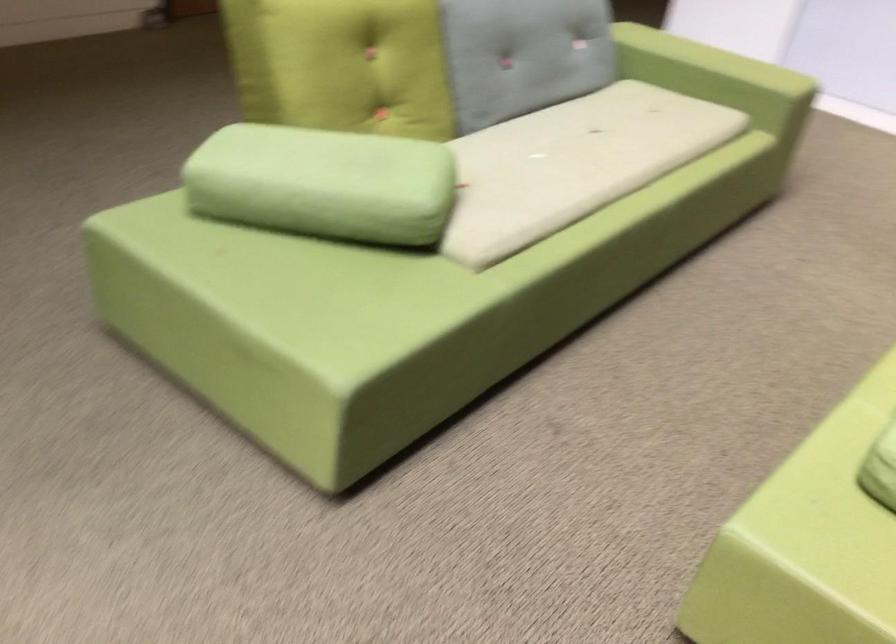
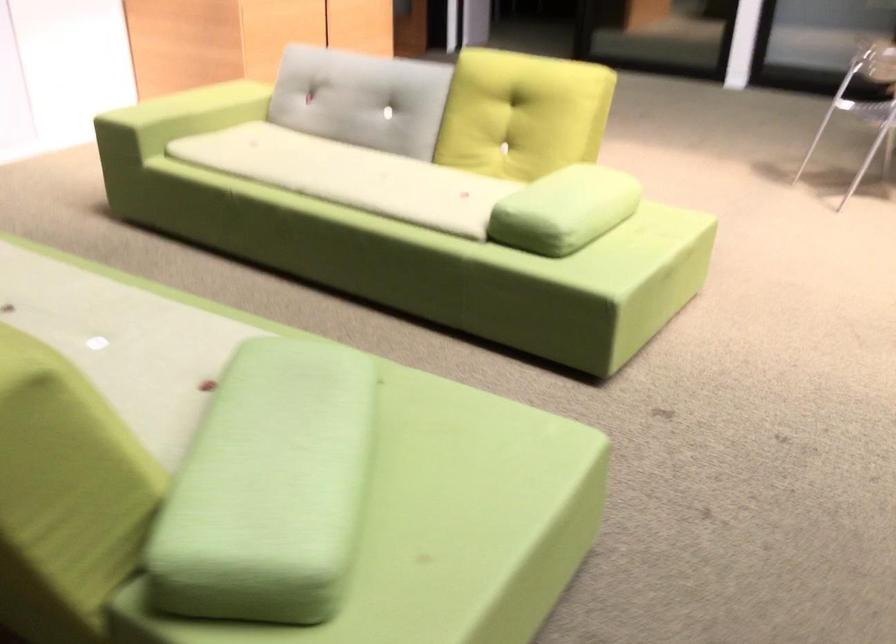
Where in the second image is the point corresponding to [254,146] from the first image?

(269, 488)